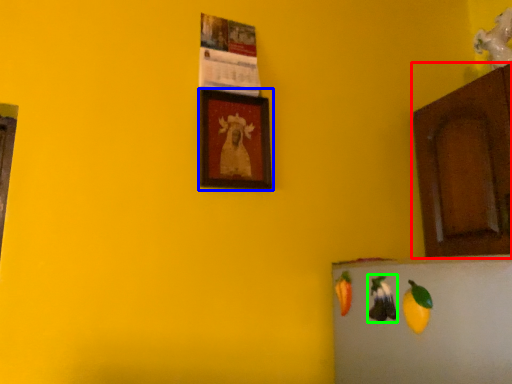
Question: Based on their relative distances, which object is nearer to cabinetry (highlighted by a red box)? Choose from picture frame (highlighted by a blue box) and fruit (highlighted by a green box).

Choices:
 (A) picture frame
 (B) fruit

Answer: (B)